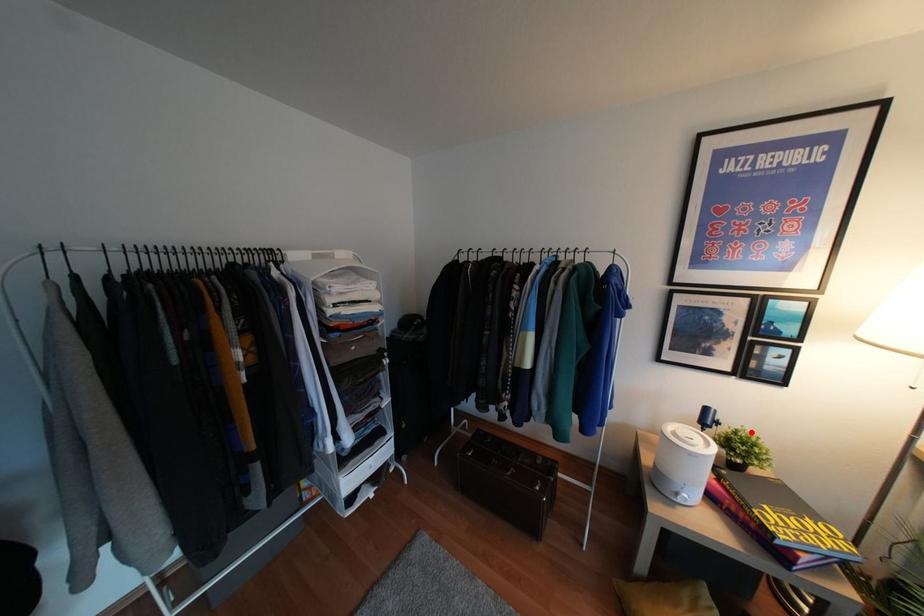
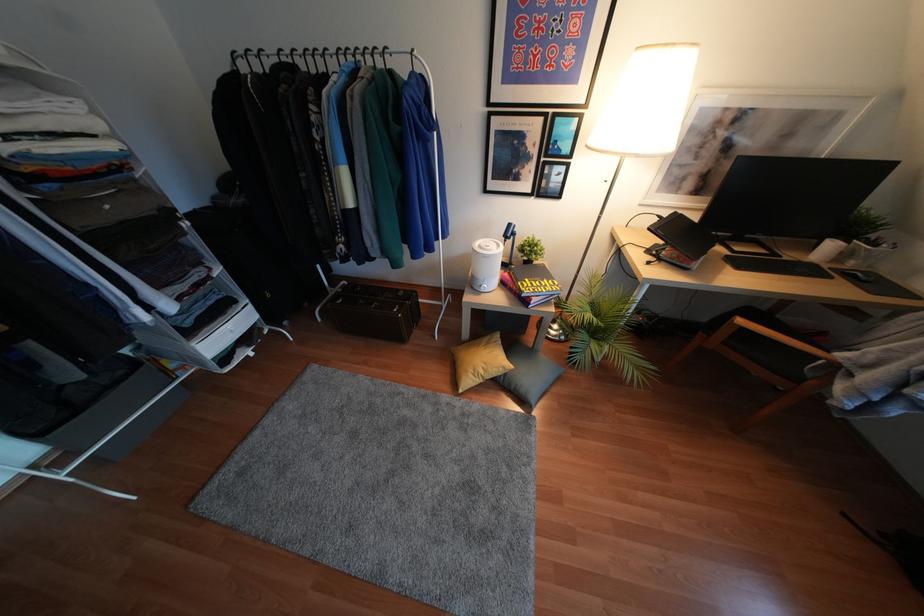
The point at the highlighted location is marked in the first image. Where is the corresponding point in the second image?

(536, 237)